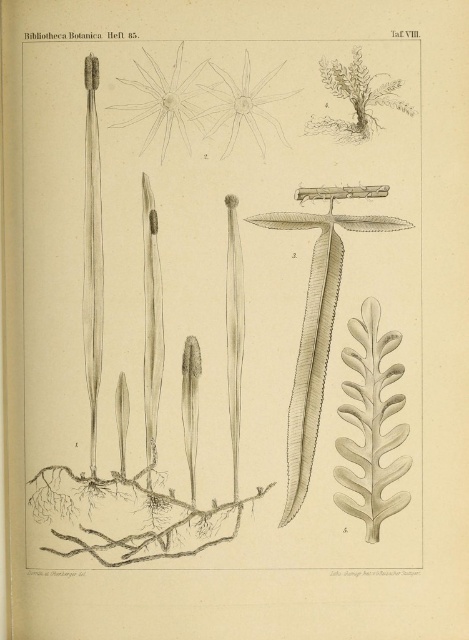
You are an art student analyzing the botanical illustration from the provided scene. You observe the gray pencil sketch of plant at center and the gray textured leaf at center right. Which of these two has a greater width in the illustration?

The gray pencil sketch of plant at center has a greater width than the gray textured leaf at center right.

Looking at the botanical illustration labeled Taf. VIII, you see a gray textured leaf at center right and a white paper flower at upper center. Which of these two objects is positioned to the east in the image?

The gray textured leaf at center right is to the right of the white paper flower at upper center, so it is positioned to the east in the image.

What is the purpose of the point at coordinates (222, 304) in the botanical illustration?

The point at coordinates (222, 304) marks a specific feature on the gray pencil sketch of the plant at the center, likely indicating a key detail for identification or study.